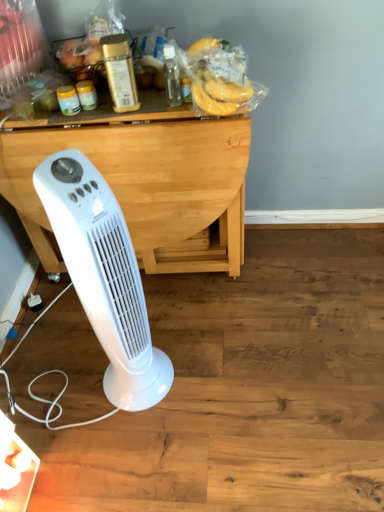
At what (x,y) coordinates should I click in order to perform the action: click on vacant space to the left of white plastic tower fan at lower left. Please return your answer as a coordinate pair (x, y). The image size is (384, 512). Looking at the image, I should click on (74, 386).